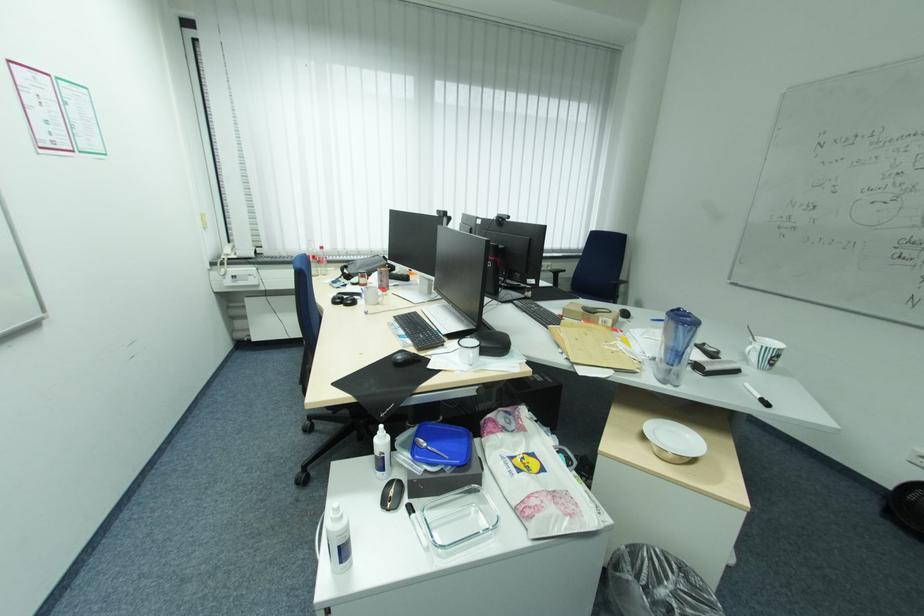
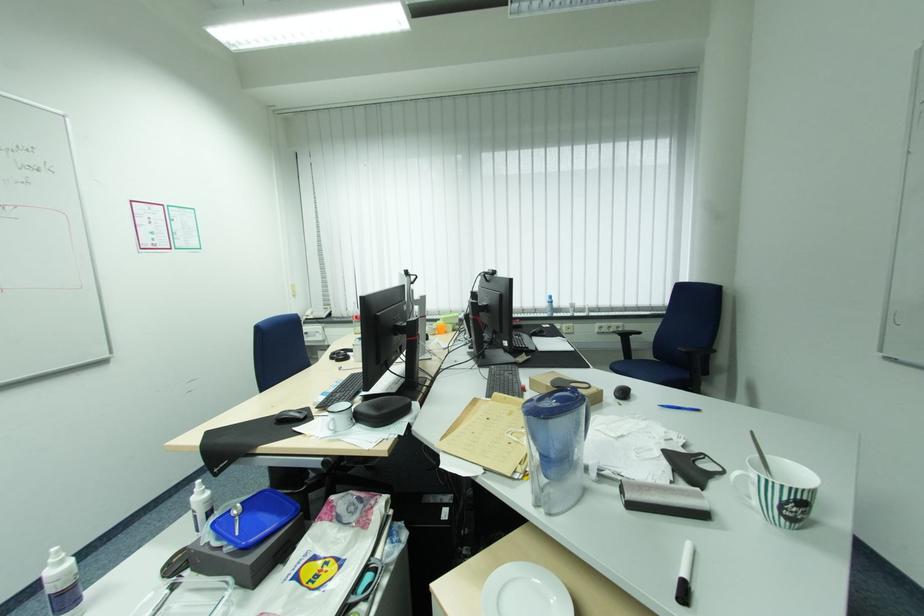
Question: I am providing you with two images of the same scene from different viewpoints. Please identify which objects are invisible in image2.

Choices:
 (A) black computer mouse
 (B) white spray bottle
 (C) chair armrest
 (D) none of these

Answer: (D)